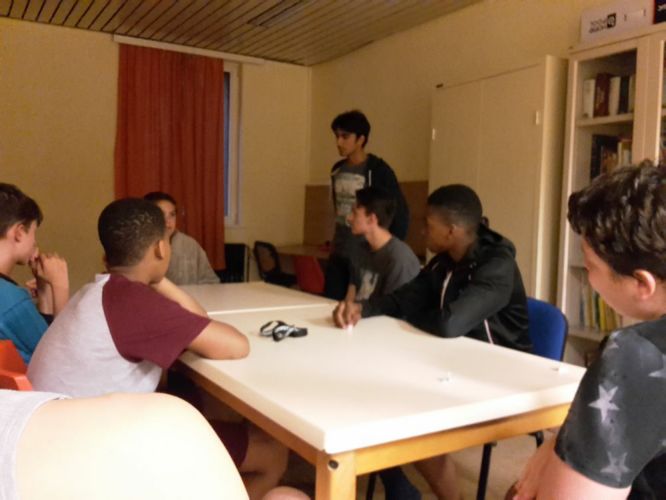
Identify the location of book. (609, 92).